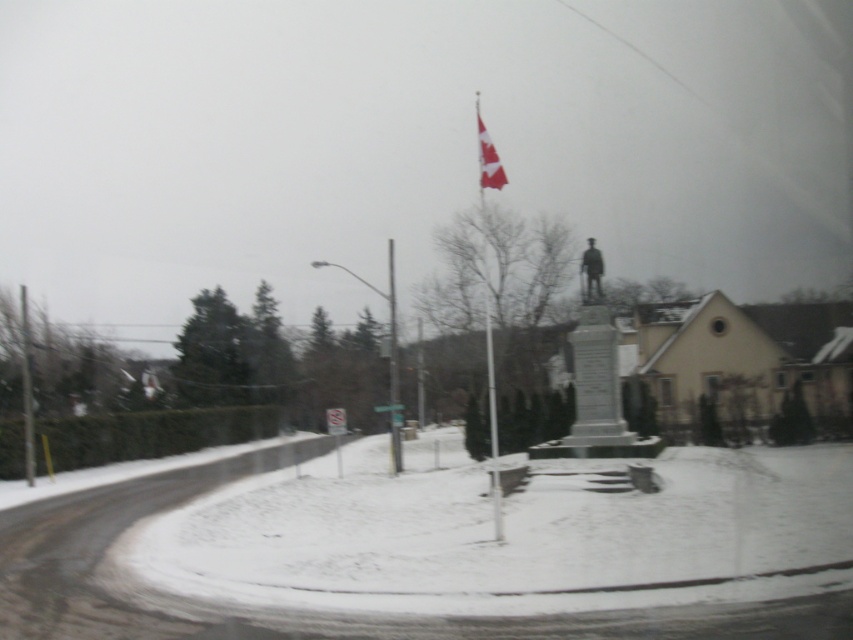
From the picture: You are a surveyor measuring distances between landmarks in the snowy scene. You need to determine if the distance between the metallic pole at left and the red and white fabric flag at upper center is more than 90 feet. What is your conclusion?

The metallic pole at left and the red and white fabric flag at upper center are 93.16 feet apart, which is more than 90 feet.

You are a tourist standing in front of the monument and want to take a photo of both the metallic pole at left and the red and white fabric flag at upper center. However, you notice that one of them is blocking your view of the other. Which object is blocking the view of the other?

The red and white fabric flag at upper center is behind the metallic pole at left, so the metallic pole at left is blocking the view of the red and white fabric flag at upper center.

You are a tourist visiting the monument and want to take a photo that includes both the red and white fabric flag at upper center and the white plastic sign at center. Based on their sizes, which object should you focus on to ensure both are in frame?

The red and white fabric flag at upper center is taller than the white plastic sign at center, so focusing on the taller flag will ensure both are visible in the photo.